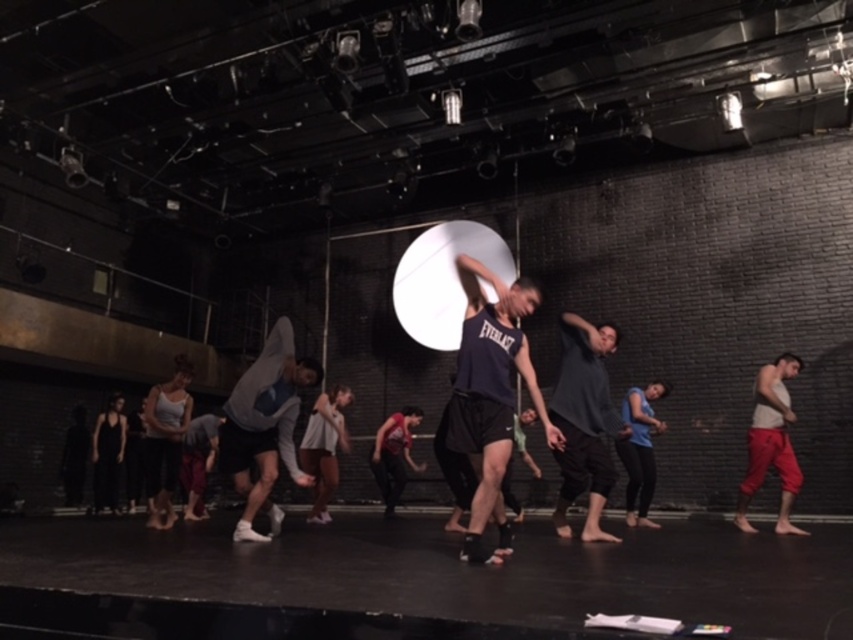
Question: Which of these objects is positioned farthest from the blue matte shirt at center?

Choices:
 (A) black matte tank top at lower left
 (B) black rubber stage at center
 (C) white matte shorts at center
 (D) navy blue athletic tank top at center

Answer: (A)

Question: Among these points, which one is farthest from the camera?

Choices:
 (A) (409, 413)
 (B) (653, 472)

Answer: (A)

Question: Can you confirm if blue matte shirt at center is positioned to the right of black matte tank top at lower left?

Choices:
 (A) no
 (B) yes

Answer: (B)

Question: Is white fabric at center bigger than black matte tank top at lower left?

Choices:
 (A) no
 (B) yes

Answer: (B)

Question: Which point is closer to the camera?

Choices:
 (A) (62, 595)
 (B) (103, 468)
 (C) (390, 436)
 (D) (503, 374)

Answer: (A)

Question: Can you confirm if gray matte hoodie at center is bigger than white cotton tank top at right?

Choices:
 (A) no
 (B) yes

Answer: (B)